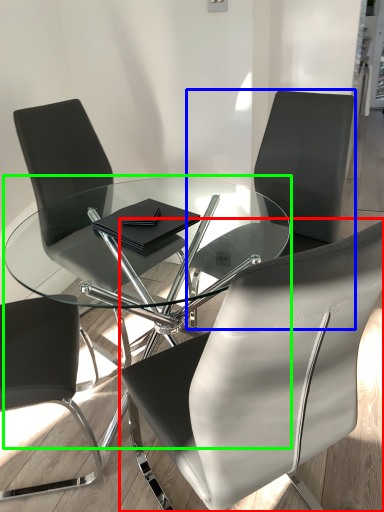
Question: Considering the real-world distances, which object is closest to chair (highlighted by a red box)? chair (highlighted by a blue box) or coffee table (highlighted by a green box).

Choices:
 (A) chair
 (B) coffee table

Answer: (B)